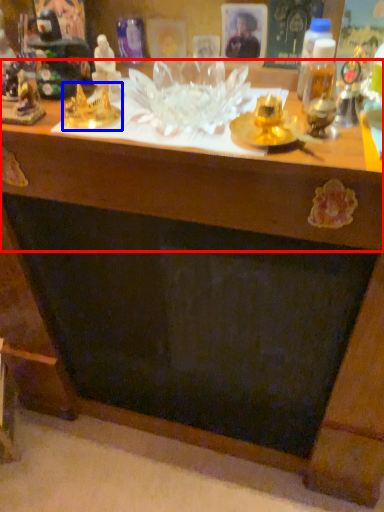
Question: Which object is closer to the camera taking this photo, table (highlighted by a red box) or toy (highlighted by a blue box)?

Choices:
 (A) table
 (B) toy

Answer: (A)